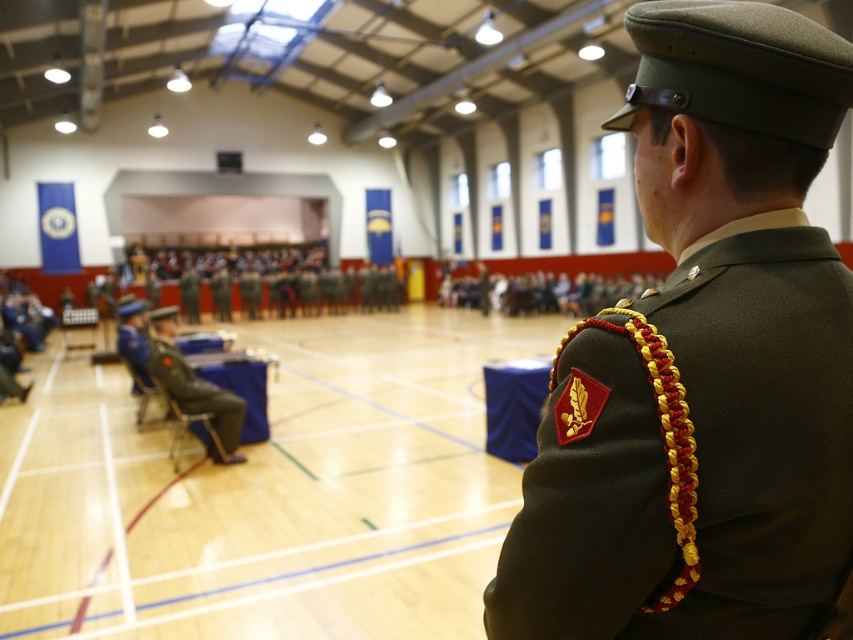
Based on the photo, measure the distance between point (772, 296) and camera.

31.57 inches

Is matte green uniform at center closer to the viewer compared to green military uniform at center?

Yes, matte green uniform at center is in front of green military uniform at center.

Which is in front, point (798, 344) or point (172, 385)?

Point (798, 344) is in front.

Where is `matte green uniform at center`? matte green uniform at center is located at coordinates (703, 360).